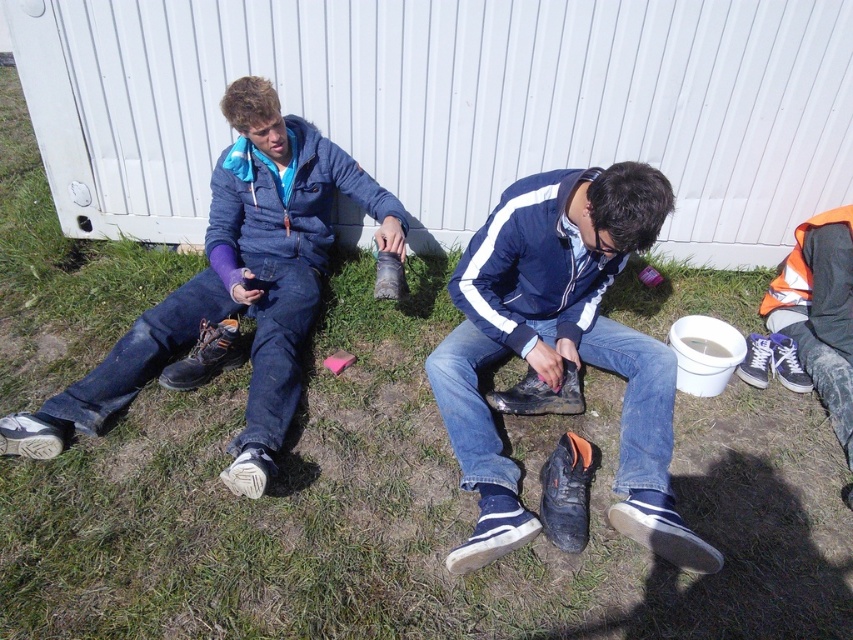
Which is in front, point (169, 387) or point (780, 369)?

Positioned in front is point (169, 387).

Between brown leather shoe at lower left and blue canvas shoe at lower right, which one is positioned higher?

brown leather shoe at lower left is higher up.

What do you see at coordinates (206, 355) in the screenshot? This screenshot has width=853, height=640. I see `brown leather shoe at lower left` at bounding box center [206, 355].

Where is `brown leather shoe at lower left`? brown leather shoe at lower left is located at coordinates (206, 355).

Is white suede shoe at lower center thinner than black rubber boot at center?

Yes.

Which is in front, point (461, 554) or point (560, 397)?

Positioned in front is point (461, 554).

This screenshot has height=640, width=853. I want to click on white suede shoe at lower center, so click(x=492, y=531).

Between white matte shoe at lower left and leather boot at center, which one appears on the left side from the viewer's perspective?

white matte shoe at lower left

Between white matte shoe at lower left and leather boot at center, which one appears on the right side from the viewer's perspective?

From the viewer's perspective, leather boot at center appears more on the right side.

Is point (18, 417) more distant than point (390, 291)?

No, it is in front of (390, 291).

Identify the location of white matte shoe at lower left. (32, 435).